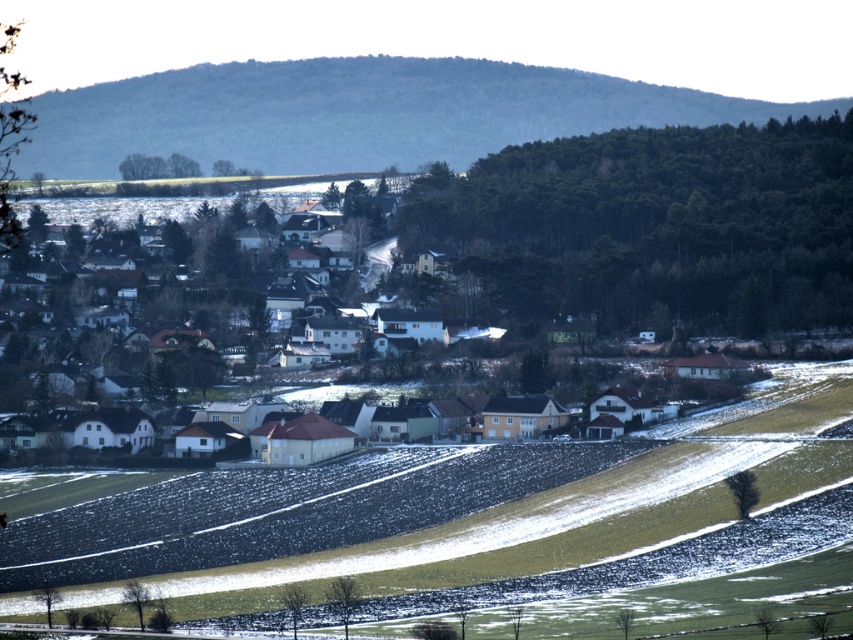
You are standing in the middle of the agricultural fields in the foreground. You want to walk towards the village. Which direction should you go to first reach the white matte houses at center before the green grassy hillside at upper center?

You should head towards the center direction because the white matte houses at center are closer to you than the green grassy hillside at upper center, which is further away.

You are standing in the middle of the agricultural fields and see the green grassy hillside at upper center and the white matte houses at center. Which object is positioned to the right of the other?

The green grassy hillside at upper center is to the right of the white matte houses at center according to the description.

You are standing in the middle of the fields in the foreground and want to reach the green grassy hillside at upper center. Which direction should you walk to get there?

You should walk towards the upper center direction to reach the green grassy hillside at upper center.